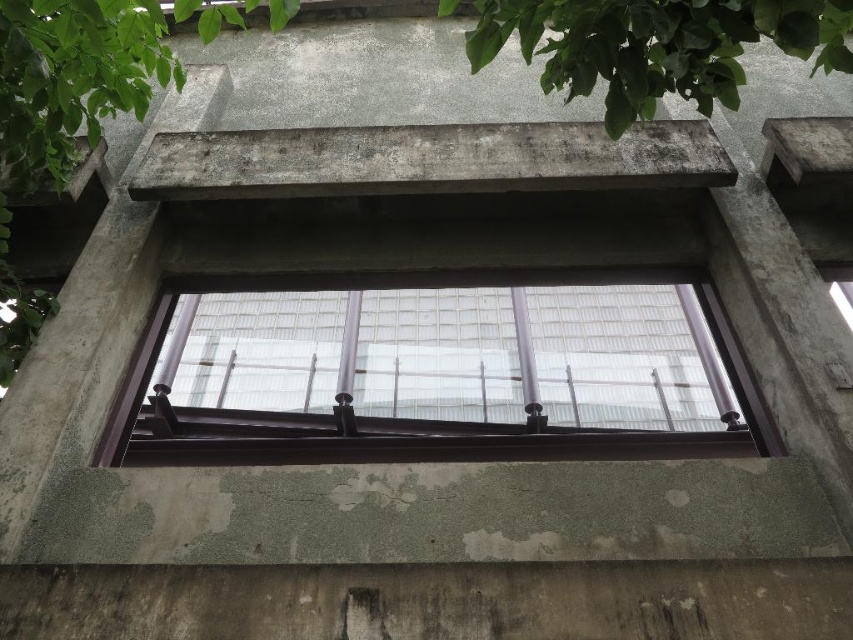
Question: Which of the following is the farthest from the observer?

Choices:
 (A) (96, 58)
 (B) (345, 380)

Answer: (B)

Question: Does clear glass window at center appear on the right side of green leafy tree at upper center?

Choices:
 (A) yes
 (B) no

Answer: (A)

Question: Is clear glass window at center bigger than green leafy tree at upper center?

Choices:
 (A) yes
 (B) no

Answer: (B)

Question: Which point is farther from the camera taking this photo?

Choices:
 (A) (465, 348)
 (B) (102, 0)

Answer: (A)

Question: Can you confirm if clear glass window at center is positioned to the left of green leafy tree at upper center?

Choices:
 (A) yes
 (B) no

Answer: (B)